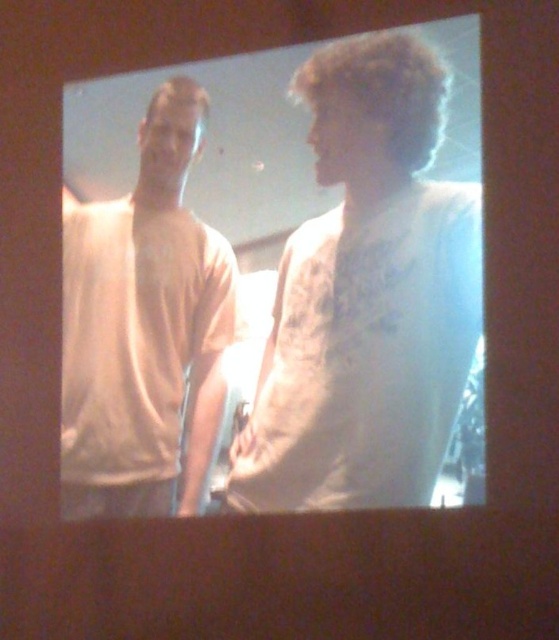
Question: Which point is farther to the camera?

Choices:
 (A) white textured shirt at center
 (B) white matte t-shirt at left

Answer: (B)

Question: Does white textured shirt at center have a larger size compared to white matte t-shirt at left?

Choices:
 (A) yes
 (B) no

Answer: (A)

Question: Can you confirm if white textured shirt at center is positioned to the right of white matte t-shirt at left?

Choices:
 (A) yes
 (B) no

Answer: (A)

Question: Which point appears farthest from the camera in this image?

Choices:
 (A) (347, 474)
 (B) (113, 492)

Answer: (B)

Question: Can you confirm if white textured shirt at center is positioned below white matte t-shirt at left?

Choices:
 (A) no
 (B) yes

Answer: (A)